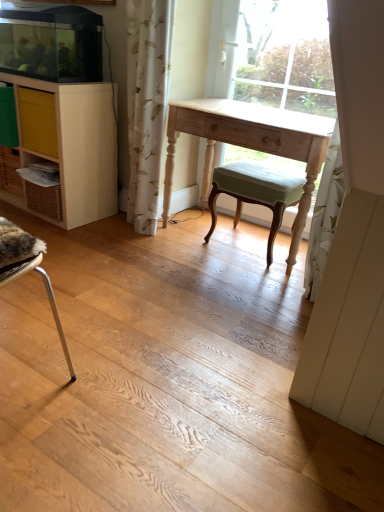
At what (x,y) coordinates should I click in order to perform the action: click on free space in front of light green fabric stool at center. Please return your answer as a coordinate pair (x, y). Image resolution: width=384 pixels, height=512 pixels. Looking at the image, I should click on (244, 273).